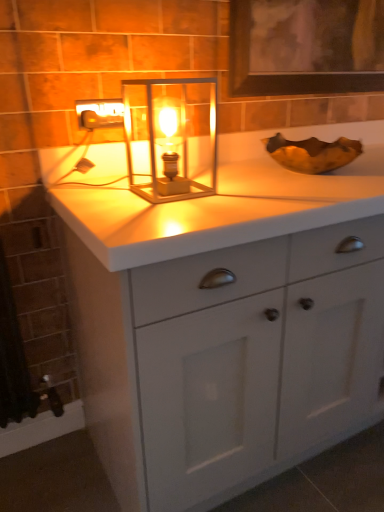
Question: Is white matte cabinet at center not inside translucent glass lantern at center?

Choices:
 (A) yes
 (B) no

Answer: (A)

Question: From a real-world perspective, is white matte cabinet at center over translucent glass lantern at center?

Choices:
 (A) no
 (B) yes

Answer: (A)

Question: From a real-world perspective, is white matte cabinet at center positioned under translucent glass lantern at center based on gravity?

Choices:
 (A) no
 (B) yes

Answer: (B)

Question: Considering the relative sizes of white matte cabinet at center and translucent glass lantern at center in the image provided, is white matte cabinet at center taller than translucent glass lantern at center?

Choices:
 (A) no
 (B) yes

Answer: (B)

Question: Does white matte cabinet at center appear on the left side of translucent glass lantern at center?

Choices:
 (A) yes
 (B) no

Answer: (B)

Question: Can you confirm if white matte cabinet at center is wider than translucent glass lantern at center?

Choices:
 (A) no
 (B) yes

Answer: (B)

Question: From a real-world perspective, is matte silver outlet at upper left beneath white matte cabinet at center?

Choices:
 (A) yes
 (B) no

Answer: (B)

Question: Is matte silver outlet at upper left at the left side of white matte cabinet at center?

Choices:
 (A) no
 (B) yes

Answer: (B)

Question: Can you confirm if matte silver outlet at upper left is smaller than white matte cabinet at center?

Choices:
 (A) no
 (B) yes

Answer: (B)

Question: From the image's perspective, would you say matte silver outlet at upper left is positioned over white matte cabinet at center?

Choices:
 (A) no
 (B) yes

Answer: (B)

Question: Is matte silver outlet at upper left oriented towards white matte cabinet at center?

Choices:
 (A) no
 (B) yes

Answer: (A)

Question: Is matte silver outlet at upper left looking in the opposite direction of white matte cabinet at center?

Choices:
 (A) no
 (B) yes

Answer: (A)

Question: Is translucent glass lantern at center outside white matte cabinet at center?

Choices:
 (A) no
 (B) yes

Answer: (B)